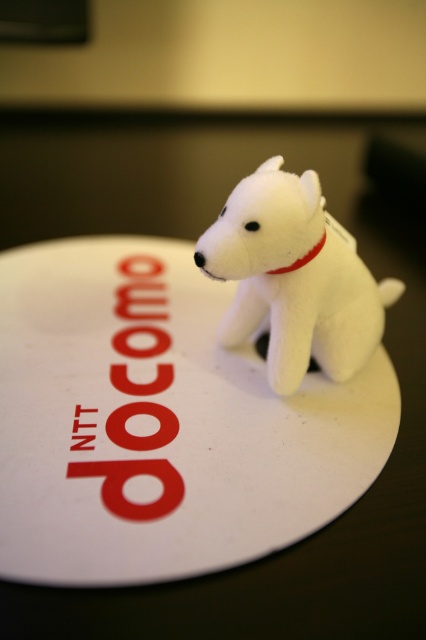
Looking at this image, you are an AI assistant analyzing the image. Please provide the exact 2D coordinates of the white plush dog at center in the image coordinate system where the origin is at the bottom left corner.

The white plush dog at center is located at coordinates 0.434 in the x axis and 0.690 in the y axis.

You are an artist trying to place a sticker on the white paper plate at center. The sticker has coordinates given as point (160, 422). Based on the scene description, where should you place the sticker on the white paper plate at center?

The point (160, 422) is on the white paper plate at center, so you should place the sticker at that coordinate on the white paper plate at center.

You are trying to place both the white plush dog at center and the white fabric neckband at center into a rectangular box. The box can only accommodate items that are narrower than 15 centimeters. Based on the scene description, can both items fit inside the box?

The white plush dog at center might be wider than white fabric neckband at center. Since the box can only accommodate items narrower than 15 centimeters, it is uncertain if both will fit without knowing their exact widths.